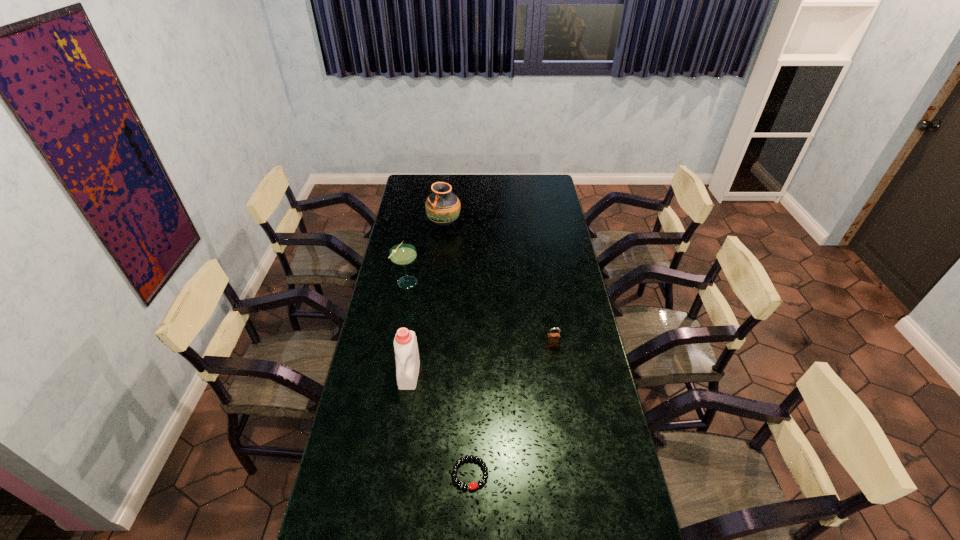
Identify the location of free area in between the pottery and the second nearest object. Image resolution: width=960 pixels, height=540 pixels. (426, 299).

Locate which object is the second closest to the third shortest object. Please provide its 2D coordinates. Your answer should be formatted as a tuple, i.e. [(x, y)], where the tuple contains the x and y coordinates of a point satisfying the conditions above.

[(405, 343)]

Locate which object ranks fourth in proximity to the pottery. Please provide its 2D coordinates. Your answer should be formatted as a tuple, i.e. [(x, y)], where the tuple contains the x and y coordinates of a point satisfying the conditions above.

[(473, 485)]

Image resolution: width=960 pixels, height=540 pixels. Identify the location of vacant space that satisfies the following two spatial constraints: 1. on the handle side of the fourth farthest object; 2. on the right side of the second object from right to left. (395, 473).

Locate an element on the screen. free spot that satisfies the following two spatial constraints: 1. on the handle side of the detergent; 2. on the left side of the fourth object from left to right is located at coordinates (395, 473).